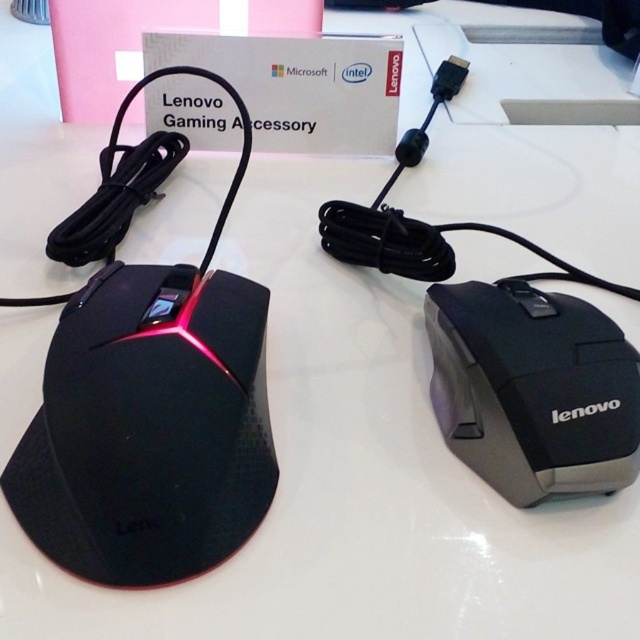
Question: Is matte black mouse at left thinner than black matte mouse at right?

Choices:
 (A) yes
 (B) no

Answer: (B)

Question: Does matte black mouse at left come in front of black matte mouse at right?

Choices:
 (A) yes
 (B) no

Answer: (A)

Question: Can you confirm if matte black mouse at left is smaller than black matte mouse at right?

Choices:
 (A) yes
 (B) no

Answer: (B)

Question: Which point appears farthest from the camera in this image?

Choices:
 (A) (596, 388)
 (B) (173, 449)

Answer: (A)